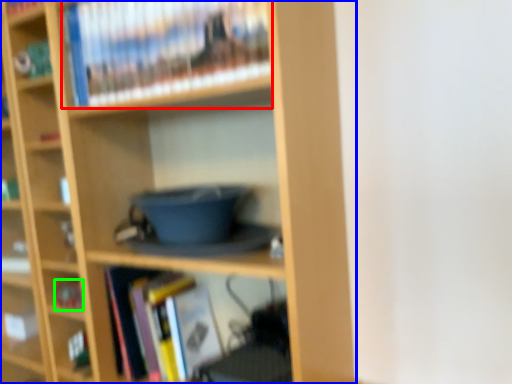
Question: Which object is the farthest from book (highlighted by a red box)? Choose among these: bookcase (highlighted by a blue box) or book (highlighted by a green box).

Choices:
 (A) bookcase
 (B) book

Answer: (B)